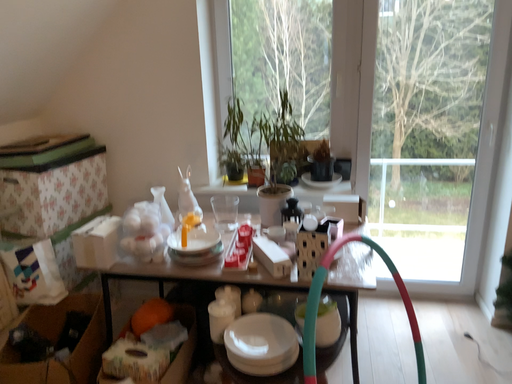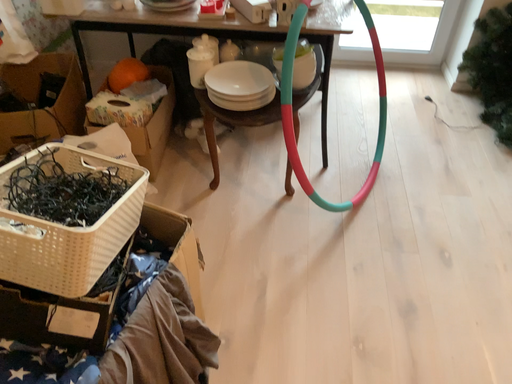
Question: Which way did the camera rotate in the video?

Choices:
 (A) rotated upward
 (B) rotated downward

Answer: (B)